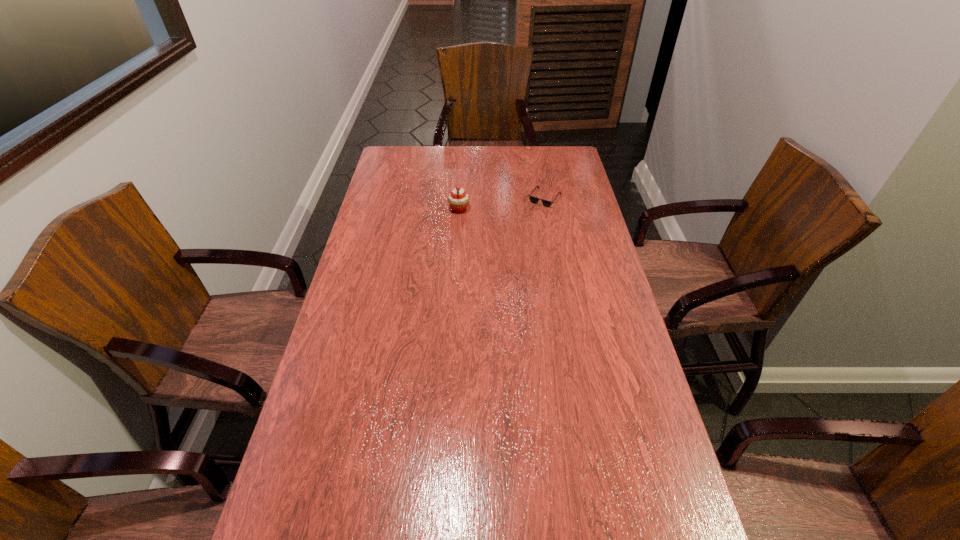
At what (x,y) coordinates should I click in order to perform the action: click on the taller object. Please return your answer as a coordinate pair (x, y). The height and width of the screenshot is (540, 960). Looking at the image, I should click on (458, 200).

The width and height of the screenshot is (960, 540). Identify the location of cupcake. (458, 200).

Where is `the right object`? The width and height of the screenshot is (960, 540). the right object is located at coordinates (534, 200).

At what (x,y) coordinates should I click in order to perform the action: click on the shorter object. Please return your answer as a coordinate pair (x, y). This screenshot has height=540, width=960. Looking at the image, I should click on (534, 200).

Locate an element on the screen. The width and height of the screenshot is (960, 540). vacant space located 0.270m on the right of the cupcake is located at coordinates (540, 210).

I want to click on vacant region located on the lenses of the sunglasses, so click(x=553, y=246).

At what (x,y) coordinates should I click in order to perform the action: click on object positioned at the right edge. Please return your answer as a coordinate pair (x, y). Looking at the image, I should click on (534, 200).

Image resolution: width=960 pixels, height=540 pixels. Identify the location of free space at the far edge of the desktop. (540, 165).

Image resolution: width=960 pixels, height=540 pixels. In the image, there is a desktop. Identify the location of vacant space at the left edge. (323, 361).

Find the location of a particular element. This screenshot has width=960, height=540. vacant space at the right edge is located at coordinates (569, 252).